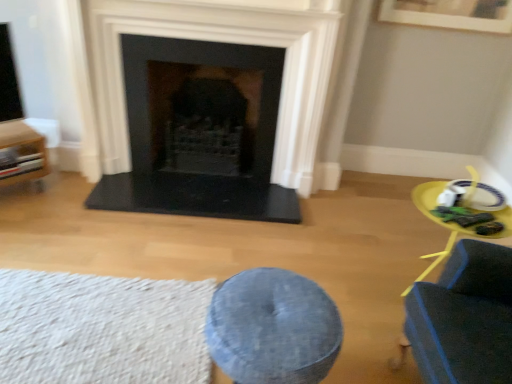
Locate an element on the screen. The image size is (512, 384). blank space to the left of yellow plastic table at right is located at coordinates (353, 281).